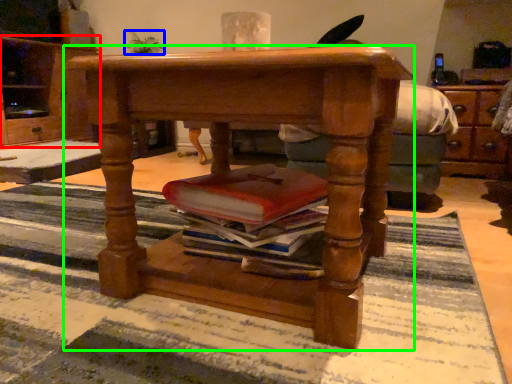
Question: Which is farther away from cabinetry (highlighted by a red box)? houseplant (highlighted by a blue box) or desk (highlighted by a green box)?

Choices:
 (A) houseplant
 (B) desk

Answer: (B)